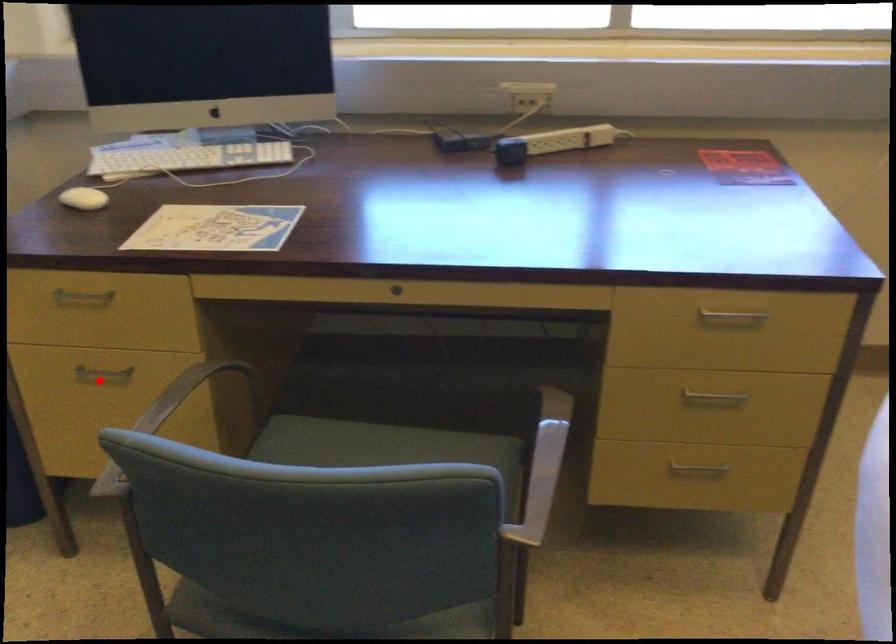
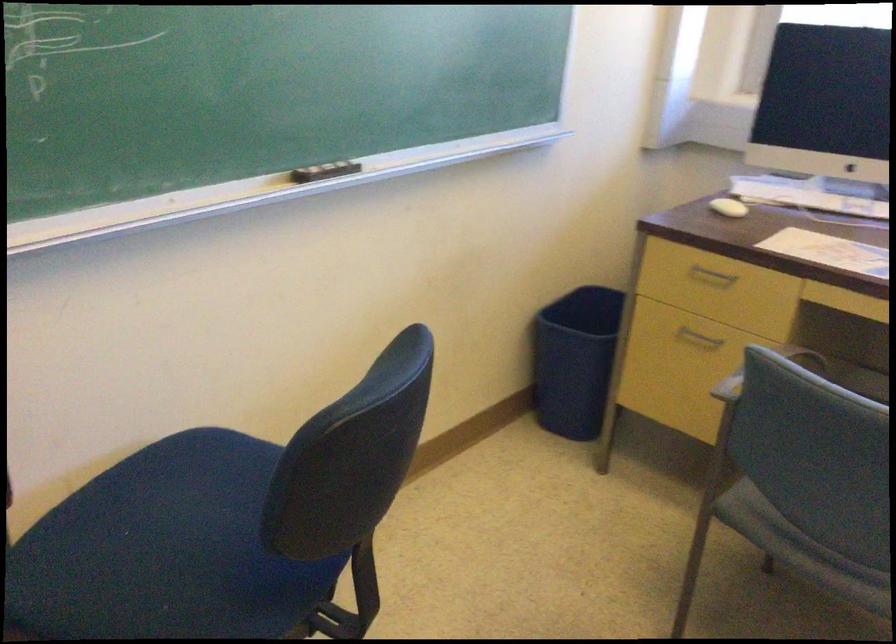
Question: I am providing you with two images of the same scene from different viewpoints. Image1 has a red point marked. In image2, the corresponding 3D location appears at what relative position? Reply with the corresponding letter.

Choices:
 (A) Closer
 (B) Farther

Answer: (B)